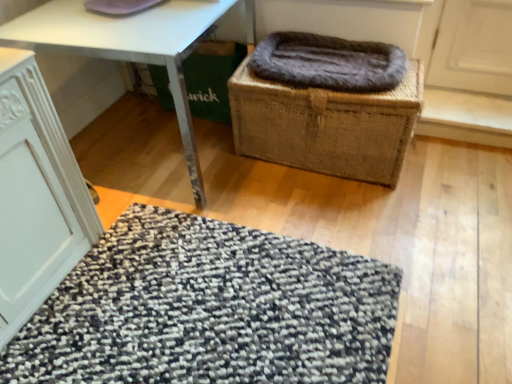
Question: Considering the relative positions of fuzzy brown blanket at center and textured gray mat at lower center in the image provided, is fuzzy brown blanket at center to the left of textured gray mat at lower center from the viewer's perspective?

Choices:
 (A) no
 (B) yes

Answer: (A)

Question: Is fuzzy brown blanket at center surrounding textured gray mat at lower center?

Choices:
 (A) yes
 (B) no

Answer: (B)

Question: Is fuzzy brown blanket at center looking in the opposite direction of textured gray mat at lower center?

Choices:
 (A) yes
 (B) no

Answer: (B)

Question: Is fuzzy brown blanket at center bigger than textured gray mat at lower center?

Choices:
 (A) yes
 (B) no

Answer: (B)

Question: Does fuzzy brown blanket at center lie behind textured gray mat at lower center?

Choices:
 (A) yes
 (B) no

Answer: (A)

Question: From a real-world perspective, is fuzzy brown blanket at center beneath textured gray mat at lower center?

Choices:
 (A) no
 (B) yes

Answer: (A)

Question: Can you confirm if white matte cabinet at lower left is shorter than textured gray mat at lower center?

Choices:
 (A) yes
 (B) no

Answer: (B)

Question: Is white matte cabinet at lower left positioned in front of textured gray mat at lower center?

Choices:
 (A) yes
 (B) no

Answer: (A)

Question: Is white matte cabinet at lower left not within textured gray mat at lower center?

Choices:
 (A) no
 (B) yes

Answer: (B)

Question: Are white matte cabinet at lower left and textured gray mat at lower center far apart?

Choices:
 (A) no
 (B) yes

Answer: (A)

Question: Does white matte cabinet at lower left appear on the right side of textured gray mat at lower center?

Choices:
 (A) yes
 (B) no

Answer: (B)

Question: Can textured gray mat at lower center be found inside white matte cabinet at lower left?

Choices:
 (A) yes
 (B) no

Answer: (B)

Question: Considering the relative positions of woven brown basket at center and textured gray mat at lower center in the image provided, is woven brown basket at center to the left of textured gray mat at lower center from the viewer's perspective?

Choices:
 (A) yes
 (B) no

Answer: (B)